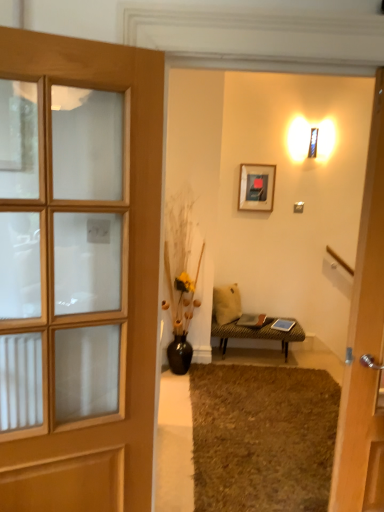
This screenshot has width=384, height=512. What do you see at coordinates (256, 334) in the screenshot?
I see `leather textured bench at center` at bounding box center [256, 334].

Where is `wooden door at left`? This screenshot has height=512, width=384. wooden door at left is located at coordinates (130, 236).

I want to click on leather textured bench at center, so click(x=256, y=334).

In the scene shown: Is matte black picture frame at upper center turned away from black ceramic vase at center?

No, matte black picture frame at upper center is not facing away from black ceramic vase at center.

Is matte black picture frame at upper center beside black ceramic vase at center?

No, matte black picture frame at upper center is not touching black ceramic vase at center.

Considering the relative sizes of matte black picture frame at upper center and black ceramic vase at center in the image provided, is matte black picture frame at upper center bigger than black ceramic vase at center?

Incorrect, matte black picture frame at upper center is not larger than black ceramic vase at center.

Is matte black picture frame at upper center at the right side of black ceramic vase at center?

Correct, you'll find matte black picture frame at upper center to the right of black ceramic vase at center.

Considering the sizes of matte black picture frame at upper center and beige fabric pillow at center in the image, is matte black picture frame at upper center taller or shorter than beige fabric pillow at center?

Clearly, matte black picture frame at upper center is taller compared to beige fabric pillow at center.

Is matte black picture frame at upper center located outside beige fabric pillow at center?

Absolutely, matte black picture frame at upper center is external to beige fabric pillow at center.

Is there a large distance between matte black picture frame at upper center and beige fabric pillow at center?

That's not correct — matte black picture frame at upper center is a little close to beige fabric pillow at center.

Considering the relative positions of matte black picture frame at upper center and beige fabric pillow at center in the image provided, is matte black picture frame at upper center to the right of beige fabric pillow at center from the viewer's perspective?

Yes.

Is point (20, 441) more distant than point (257, 195)?

No, (20, 441) is in front of (257, 195).

Considering the relative positions of wooden door at left and matte black picture frame at upper center in the image provided, is wooden door at left behind matte black picture frame at upper center?

No, it is not.

From the picture: Can you confirm if wooden door at left is taller than matte black picture frame at upper center?

Indeed, wooden door at left has a greater height compared to matte black picture frame at upper center.

Considering the relative positions of wooden door at left and matte black picture frame at upper center in the image provided, is wooden door at left to the left of matte black picture frame at upper center from the viewer's perspective?

Yes, wooden door at left is to the left of matte black picture frame at upper center.

Considering the relative sizes of beige fabric pillow at center and brown shaggy rug at lower center in the image provided, is beige fabric pillow at center wider than brown shaggy rug at lower center?

Incorrect, the width of beige fabric pillow at center does not surpass that of brown shaggy rug at lower center.

From the image's perspective, is beige fabric pillow at center positioned above or below brown shaggy rug at lower center?

From the image's perspective, beige fabric pillow at center appears above brown shaggy rug at lower center.

In the scene shown: Can you confirm if beige fabric pillow at center is smaller than brown shaggy rug at lower center?

Yes.

From a real-world perspective, is beige fabric pillow at center under brown shaggy rug at lower center?

Answer: No, from a real-world perspective, beige fabric pillow at center is not beneath brown shaggy rug at lower center.

Is beige fabric pillow at center oriented away from matte black picture frame at upper center?

That's not correct — beige fabric pillow at center is not looking away from matte black picture frame at upper center.

Between point (238, 304) and point (266, 187), which one is positioned in front?

Point (266, 187)

Is beige fabric pillow at center spatially inside matte black picture frame at upper center, or outside of it?

beige fabric pillow at center is not inside matte black picture frame at upper center, it's outside.

Where is `pillow below the matte black picture frame at upper center (from a real-world perspective)`? pillow below the matte black picture frame at upper center (from a real-world perspective) is located at coordinates (226, 303).

Who is shorter, brown shaggy rug at lower center or leather textured bench at center?

brown shaggy rug at lower center is shorter.

Considering the relative positions of brown shaggy rug at lower center and leather textured bench at center in the image provided, is brown shaggy rug at lower center to the left or to the right of leather textured bench at center?

Based on their positions, brown shaggy rug at lower center is located to the left of leather textured bench at center.

Between brown shaggy rug at lower center and leather textured bench at center, which one has smaller size?

Smaller between the two is leather textured bench at center.

Is point (229, 334) behind point (234, 310)?

That is False.

Identify the location of pillow above the leather textured bench at center (from the image's perspective). The height and width of the screenshot is (512, 384). (226, 303).

Between leather textured bench at center and beige fabric pillow at center, which one has larger size?

With larger size is leather textured bench at center.

Find the location of `houseplant in front of the matte black picture frame at upper center`. houseplant in front of the matte black picture frame at upper center is located at coordinates (181, 278).

Locate an element on the screen. The width and height of the screenshot is (384, 512). picture frame that is on the right side of beige fabric pillow at center is located at coordinates (x=256, y=187).

When comparing their distances from matte black picture frame at upper center, does black ceramic vase at center or leather textured bench at center seem further?

leather textured bench at center is further to matte black picture frame at upper center.

Which object lies nearer to the anchor point beige fabric pillow at center, matte black picture frame at upper center or black ceramic vase at center?

The object closer to beige fabric pillow at center is black ceramic vase at center.

Based on the photo, estimate the real-world distances between objects in this image. Which object is further from wooden door at left, black ceramic vase at center or leather textured bench at center?

leather textured bench at center is further to wooden door at left.

When comparing their distances from black ceramic vase at center, does beige fabric pillow at center or matte black picture frame at upper center seem closer?

beige fabric pillow at center lies closer to black ceramic vase at center than the other object.

Which object lies further to the anchor point black ceramic vase at center, beige fabric pillow at center or brown shaggy rug at lower center?

brown shaggy rug at lower center is further to black ceramic vase at center.

Which object lies nearer to the anchor point black ceramic vase at center, leather textured bench at center or beige fabric pillow at center?

beige fabric pillow at center is positioned closer to the anchor black ceramic vase at center.

Based on their spatial positions, is beige fabric pillow at center or wooden door at left further from brown shaggy rug at lower center?

wooden door at left.

Based on the photo, from the image, which object appears to be farther from brown shaggy rug at lower center, black ceramic vase at center or leather textured bench at center?

black ceramic vase at center.

I want to click on houseplant positioned between wooden door at left and leather textured bench at center from near to far, so click(181, 278).

The image size is (384, 512). In order to click on pillow between wooden door at left and matte black picture frame at upper center in the front-back direction in this screenshot , I will do point(226,303).

I want to click on pillow between black ceramic vase at center and leather textured bench at center from left to right, so click(x=226, y=303).

This screenshot has width=384, height=512. I want to click on pillow that lies between matte black picture frame at upper center and leather textured bench at center from top to bottom, so click(226, 303).